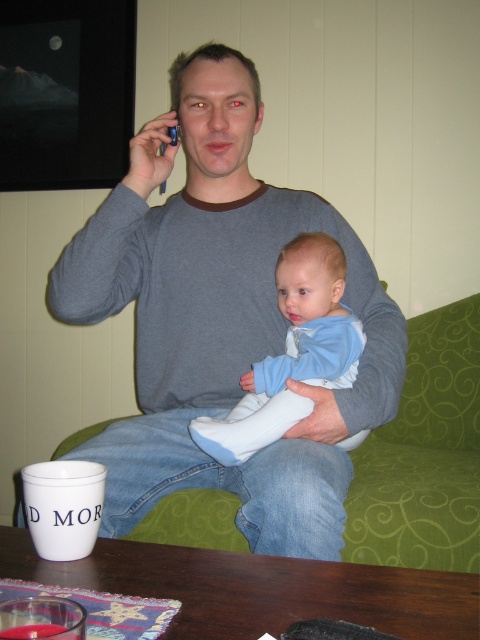
From the picture: Between gray cotton sweater at center and light blue fabric baby at center, which one has more height?

gray cotton sweater at center is taller.

Is point (342, 220) in front of point (259, 364)?

No, it is not.

The image size is (480, 640). I want to click on gray cotton sweater at center, so click(x=220, y=317).